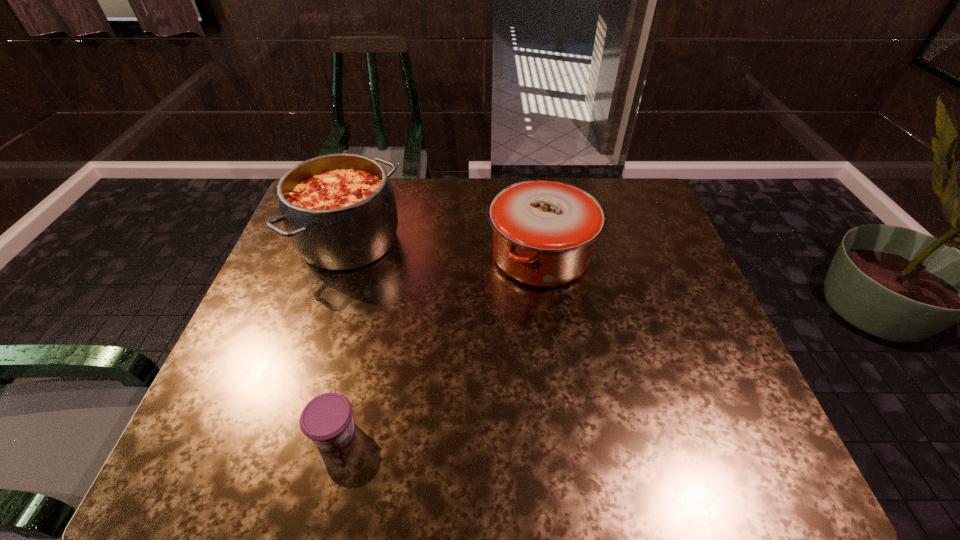
You are a GUI agent. You are given a task and a screenshot of the screen. Output one action in this format:
    pyautogui.click(x=<x>, y=<y>)
    Task: Click on the left casserole
    This screenshot has height=540, width=960.
    Given the screenshot: What is the action you would take?
    pyautogui.click(x=339, y=210)

Locate an element on the screen. This screenshot has width=960, height=540. the rightmost object is located at coordinates (544, 230).

Where is `the nearest object`? This screenshot has height=540, width=960. the nearest object is located at coordinates (327, 420).

This screenshot has width=960, height=540. What are the coordinates of `jam` in the screenshot? It's located at (327, 420).

What are the coordinates of `vacant space situated on the right of the left casserole` in the screenshot? It's located at (507, 241).

Locate an element on the screen. free space located on the back of the right casserole is located at coordinates (530, 180).

Image resolution: width=960 pixels, height=540 pixels. I want to click on object that is at the near edge, so click(327, 420).

This screenshot has width=960, height=540. I want to click on object that is at the left edge, so click(x=339, y=210).

At what (x,y) coordinates should I click in order to perform the action: click on object that is at the far left corner. Please return your answer as a coordinate pair (x, y). Looking at the image, I should click on click(x=339, y=210).

At what (x,y) coordinates should I click in order to perform the action: click on vacant space at the far edge of the desktop. Please return your answer as a coordinate pair (x, y). Looking at the image, I should click on (431, 202).